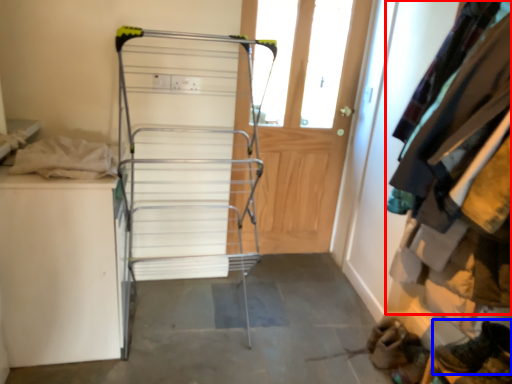
Question: Which object is closer to the camera taking this photo, clothing (highlighted by a red box) or footwear (highlighted by a blue box)?

Choices:
 (A) clothing
 (B) footwear

Answer: (A)